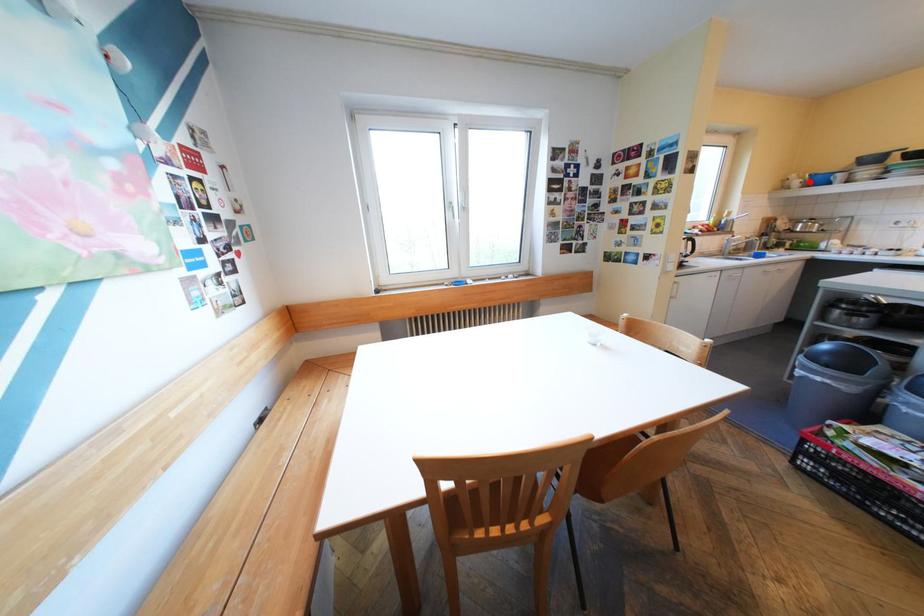
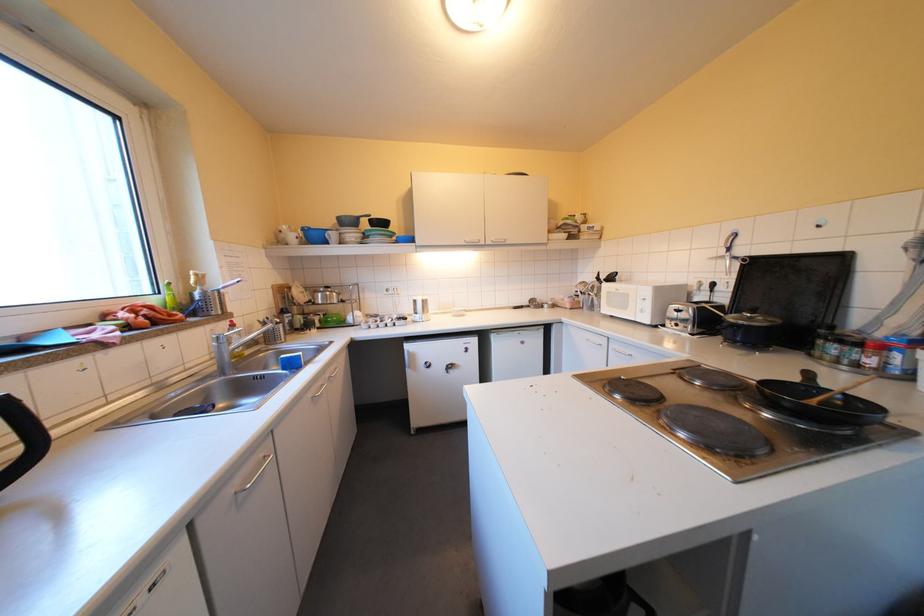
Question: I am providing you with two images of the same scene from different viewpoints. Image1 has a red point marked. In image2, the corresponding 3D location appears at what relative position? Reply with the corresponding letter.

Choices:
 (A) Closer
 (B) Farther

Answer: (A)